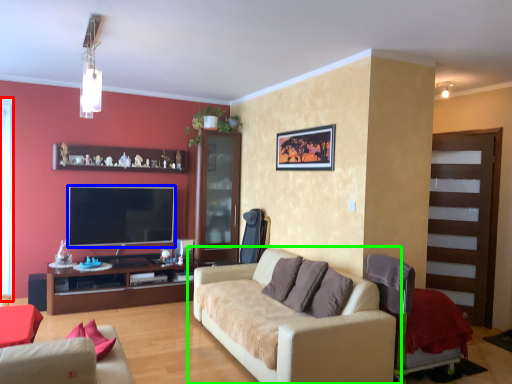
Question: Estimate the real-world distances between objects in this image. Which object is closer to window screen (highlighted by a red box), television (highlighted by a blue box) or studio couch (highlighted by a green box)?

Choices:
 (A) television
 (B) studio couch

Answer: (A)